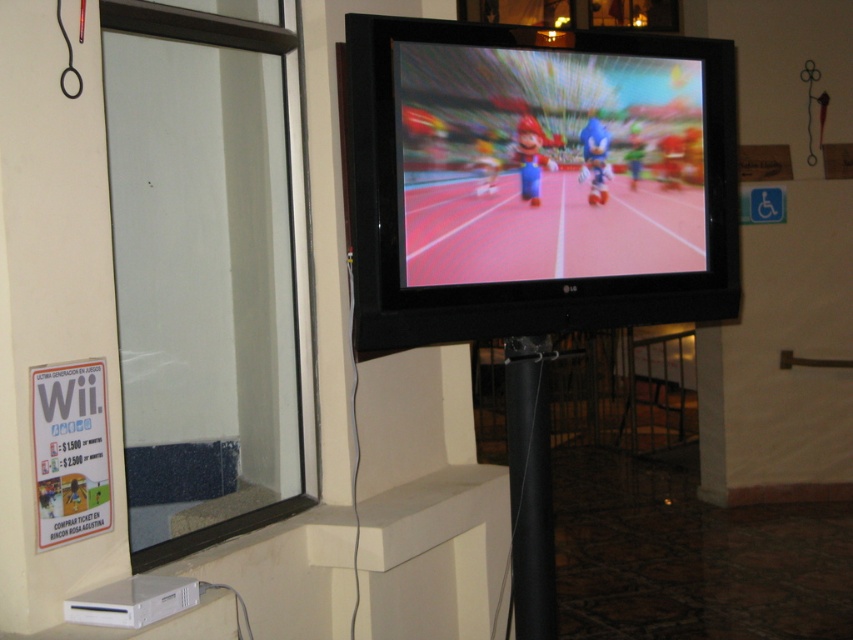
Question: Is matte plastic screen at center above black matte pole at center?

Choices:
 (A) no
 (B) yes

Answer: (B)

Question: Can you confirm if matte plastic screen at center is positioned to the right of black matte pole at center?

Choices:
 (A) yes
 (B) no

Answer: (A)

Question: Which of the following is the closest to the observer?

Choices:
 (A) matte plastic screen at center
 (B) black matte pole at center

Answer: (A)

Question: Does matte plastic screen at center appear on the right side of black matte pole at center?

Choices:
 (A) yes
 (B) no

Answer: (A)